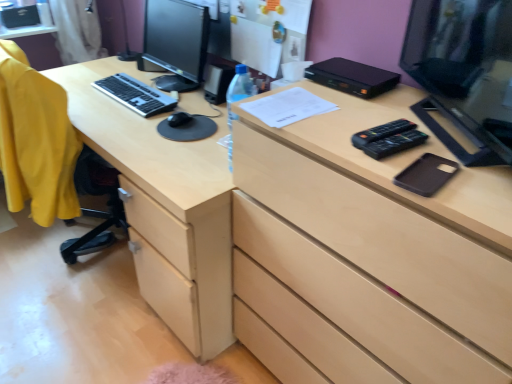
Where is `vacant space in between black glossy monitor at upper right, the first computer monitor from the front, and black matte phone case at right`? The width and height of the screenshot is (512, 384). vacant space in between black glossy monitor at upper right, the first computer monitor from the front, and black matte phone case at right is located at coordinates (424, 146).